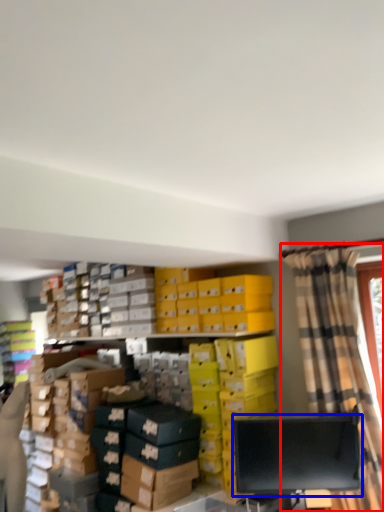
Question: Which object appears farthest to the camera in this image, curtain (highlighted by a red box) or computer monitor (highlighted by a blue box)?

Choices:
 (A) curtain
 (B) computer monitor

Answer: (B)